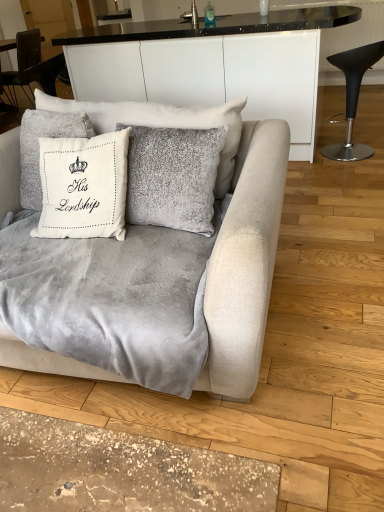
Question: From the image's perspective, relative to black leather stool at right, is velvet gray couch at center above or below?

Choices:
 (A) below
 (B) above

Answer: (A)

Question: In terms of width, does velvet gray couch at center look wider or thinner when compared to black leather stool at right?

Choices:
 (A) thin
 (B) wide

Answer: (B)

Question: Which of these objects is positioned farthest from the velvet gray blanket at center?

Choices:
 (A) white velvet cushion at upper center, which ranks as the second pillow in right-to-left order
 (B) velvet gray couch at center
 (C) brushed metal faucet at upper center
 (D) white velvet cushion at center, marked as the 2th pillow in a left-to-right arrangement
 (E) black leather stool at right

Answer: (C)

Question: Which is farther from the white velvet cushion at upper center, which ranks as the second pillow in right-to-left order?

Choices:
 (A) black leather stool at right
 (B) velvet gray couch at center
 (C) white velvet cushion at center, positioned as the 1th pillow in right-to-left order
 (D) brushed metal faucet at upper center
 (E) velvet gray blanket at center

Answer: (D)